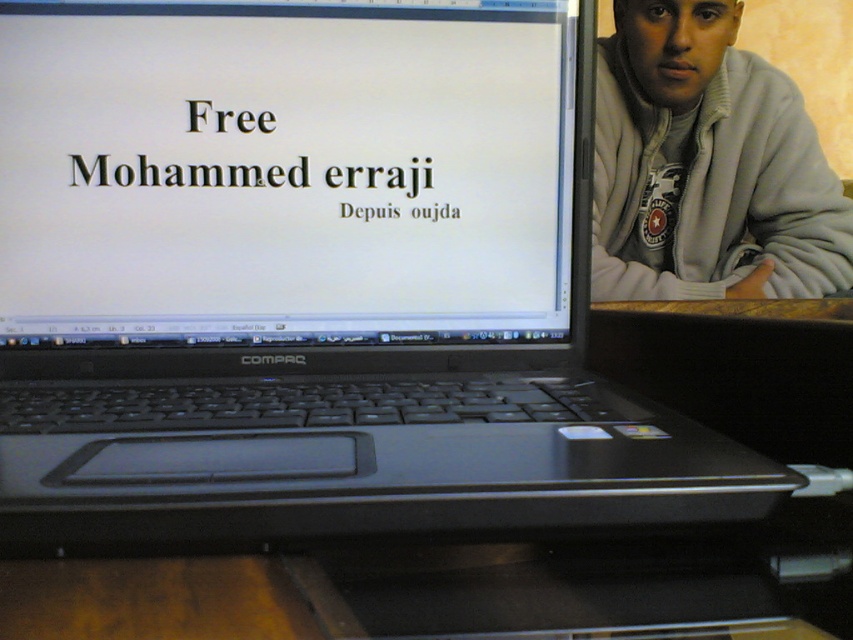
You are trying to determine the relative sizes of objects in the image. Which object is smaller between the white matte screen at center and the gray fleece jacket at upper right?

The white matte screen at center is smaller than the gray fleece jacket at upper right according to the description.

You are looking at a computer setup in an office. You see a white matte screen at center and a gray fleece jacket at upper right. Which object is positioned more to the left?

The white matte screen at center is positioned to the left of the gray fleece jacket at upper right, so the white matte screen at center is more to the left.